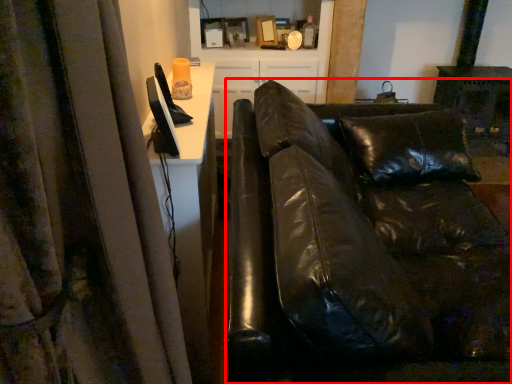
Question: Considering the relative positions of studio couch (annotated by the red box) and entertainment center in the image provided, where is studio couch (annotated by the red box) located with respect to the staircase?

Choices:
 (A) left
 (B) right

Answer: (B)